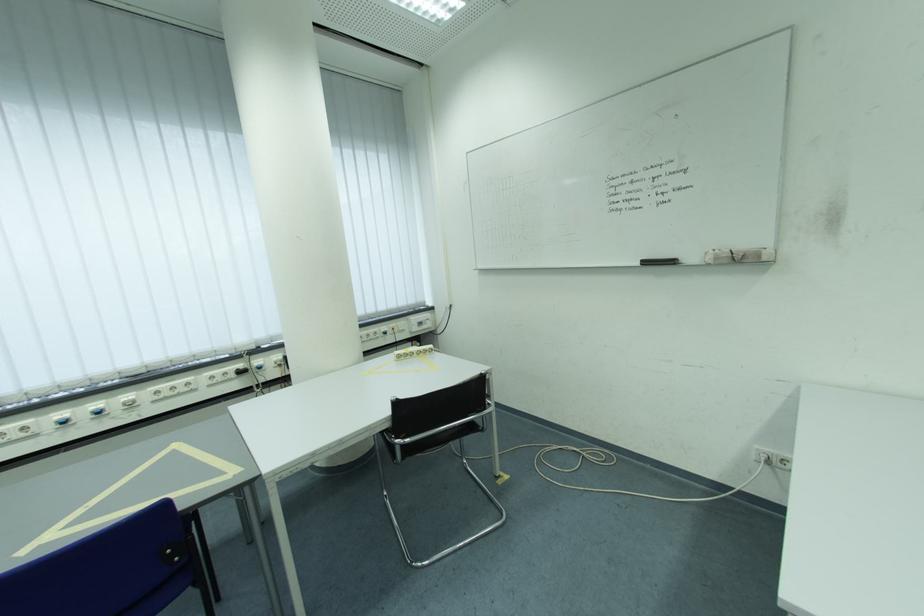
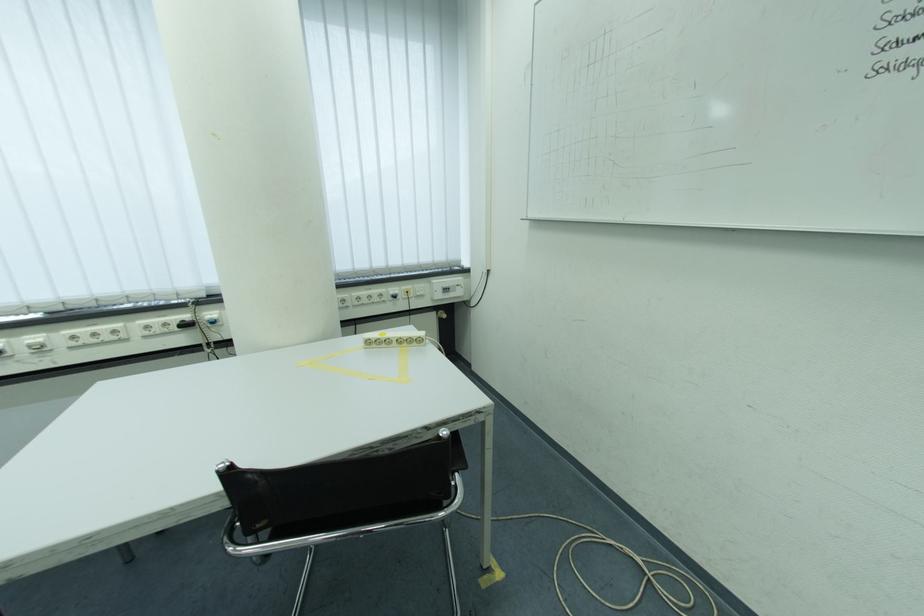
Where in the second image is the point corresponding to pixel 266 363 from the first image?

(217, 315)